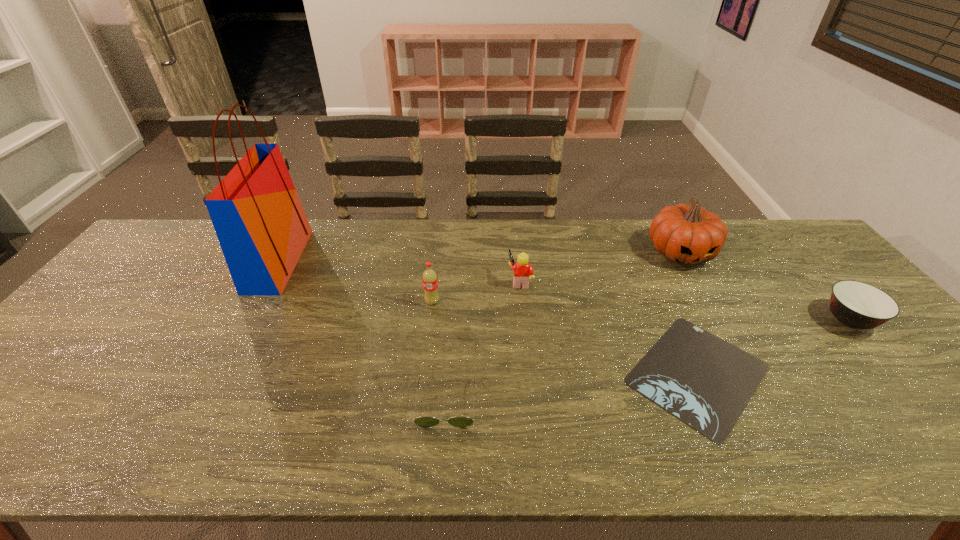
Where is `blank region between the third shortest object and the leftmost object`? Image resolution: width=960 pixels, height=540 pixels. blank region between the third shortest object and the leftmost object is located at coordinates (564, 291).

Find the location of a particular element. object that is the third closest to the shortest object is located at coordinates (857, 305).

Locate which object ranks sixth in proximity to the fourth tallest object. Please provide its 2D coordinates. Your answer should be formatted as a tuple, i.e. [(x, y)], where the tuple contains the x and y coordinates of a point satisfying the conditions above.

[(857, 305)]

The height and width of the screenshot is (540, 960). I want to click on blank space that satisfies the following two spatial constraints: 1. on the handle side of the soup bowl; 2. on the left side of the tallest object, so click(247, 320).

What are the coordinates of `free spot that satisfies the following two spatial constraints: 1. on the face of the pumpkin; 2. in front of the fourth tallest object with the accessory visible` in the screenshot? It's located at (697, 281).

Find the location of a particular element. The width and height of the screenshot is (960, 540). vacant region that satisfies the following two spatial constraints: 1. on the handle side of the fifth tallest object; 2. on the right side of the tallest object is located at coordinates (247, 320).

Locate an element on the screen. vacant space that satisfies the following two spatial constraints: 1. in front of the mousepad with the accessory visible; 2. on the left side of the Lego is located at coordinates (529, 374).

You are a GUI agent. You are given a task and a screenshot of the screen. Output one action in this format:
    pyautogui.click(x=<x>, y=<y>)
    Task: Click on the free space that satisfies the following two spatial constraints: 1. on the face of the soup bowl; 2. on the right side of the pumpkin
    
    Given the screenshot: What is the action you would take?
    pyautogui.click(x=718, y=320)

This screenshot has width=960, height=540. What are the coordinates of `free space that satisfies the following two spatial constraints: 1. on the handle side of the shopping bag; 2. on the right side of the rightmost object` in the screenshot? It's located at click(247, 320).